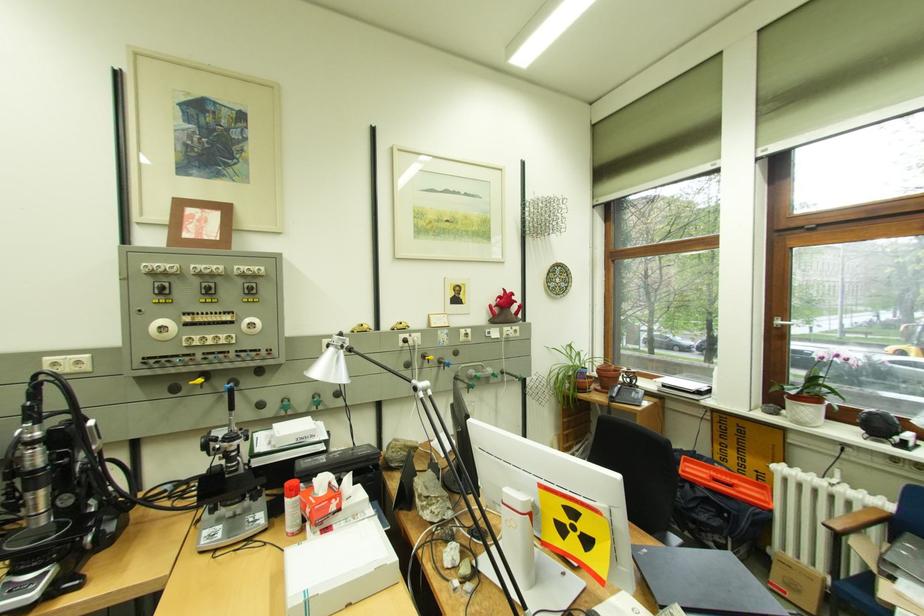
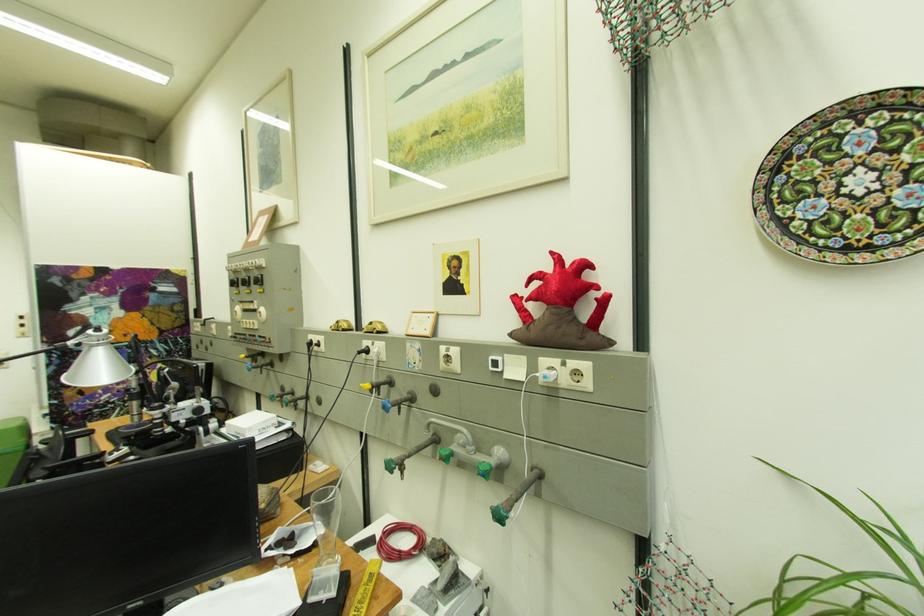
Find the pixel in the second image that matches point (472, 331) in the first image.

(454, 351)